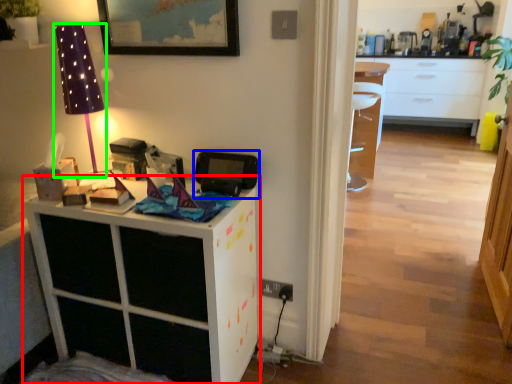
Question: Based on their relative distances, which object is nearer to cabinetry (highlighted by a red box)? Choose from appliance (highlighted by a blue box) and table lamp (highlighted by a green box).

Choices:
 (A) appliance
 (B) table lamp

Answer: (A)